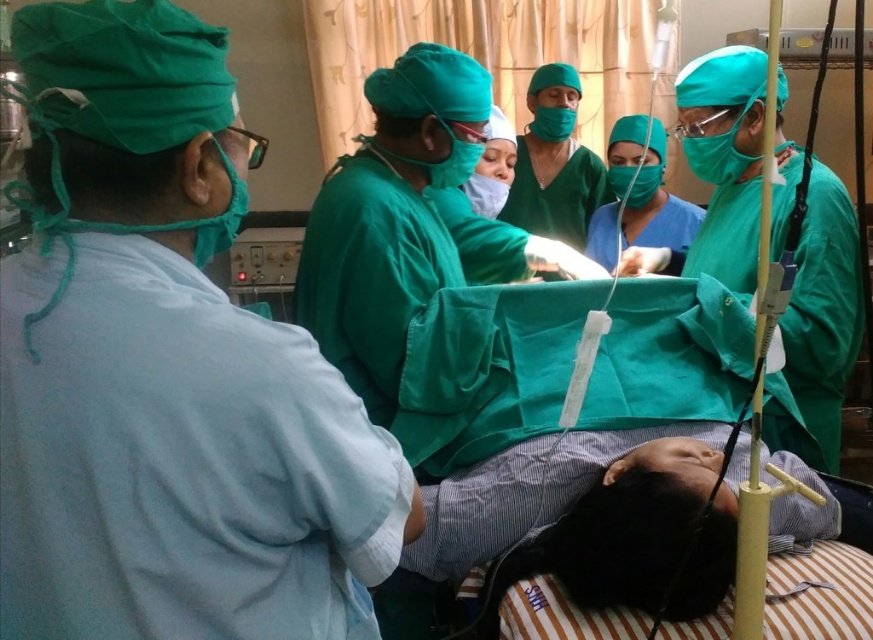
Which is behind, point (277, 378) or point (523, 196)?

Point (523, 196)

Between point (235, 438) and point (581, 179), which one is positioned behind?

Point (581, 179)

Image resolution: width=873 pixels, height=640 pixels. I want to click on matte green gown at left, so click(166, 369).